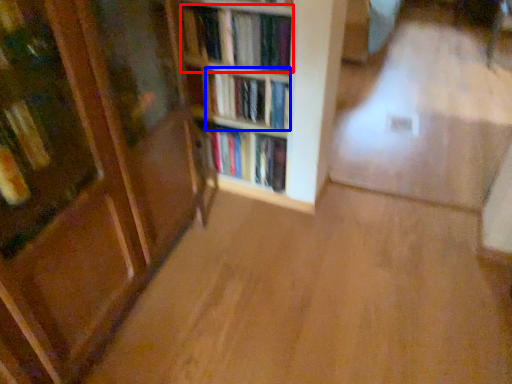
Question: Which of the following is the closest to the observer, book (highlighted by a red box) or book (highlighted by a blue box)?

Choices:
 (A) book
 (B) book

Answer: (A)